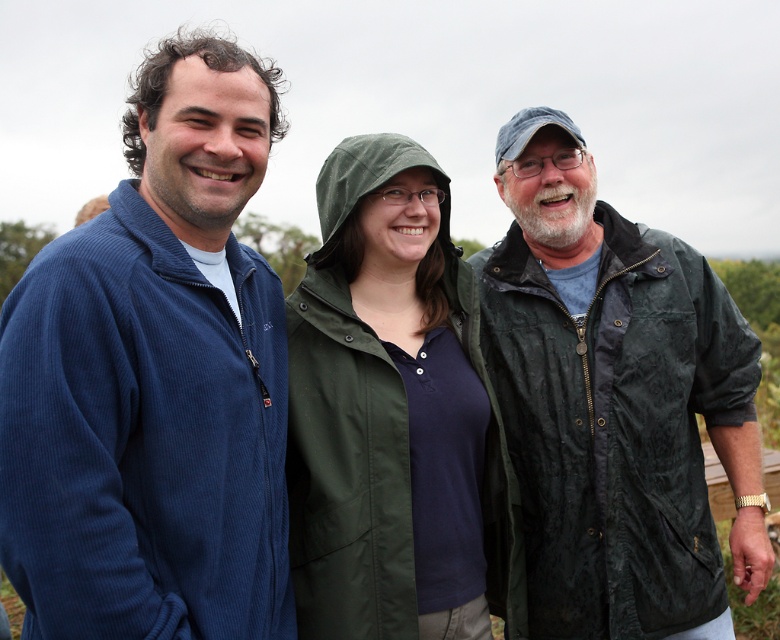
This screenshot has width=780, height=640. Describe the element at coordinates (610, 397) in the screenshot. I see `dark green waxed jacket at right` at that location.

Can you confirm if dark green waxed jacket at right is wider than green fabric jacket at center?

Indeed, dark green waxed jacket at right has a greater width compared to green fabric jacket at center.

Does point (640, 588) come farther from viewer compared to point (300, 538)?

Yes, it is.

Locate an element on the screen. The width and height of the screenshot is (780, 640). dark green waxed jacket at right is located at coordinates (610, 397).

Does corduroy blue jacket at left come behind dark green waxed jacket at right?

No, it is in front of dark green waxed jacket at right.

Which is in front, point (158, 147) or point (537, 365)?

Point (158, 147)

Does point (181, 605) come closer to viewer compared to point (667, 504)?

Yes, it is.

Identify the location of corduroy blue jacket at left. This screenshot has height=640, width=780. (154, 380).

Can you confirm if corduroy blue jacket at left is wider than green fabric jacket at center?

No.

Describe the element at coordinates (154, 380) in the screenshot. I see `corduroy blue jacket at left` at that location.

Is point (4, 316) positioned after point (452, 276)?

No, it is not.

The height and width of the screenshot is (640, 780). In order to click on corduroy blue jacket at left in this screenshot , I will do `click(154, 380)`.